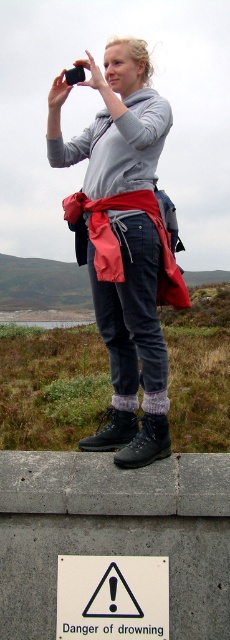
How far apart are gray concrete at upper center and white plastic sign at lower center?

gray concrete at upper center and white plastic sign at lower center are 21.43 centimeters apart from each other.

Where is `gray concrete at upper center`? This screenshot has height=640, width=230. gray concrete at upper center is located at coordinates (114, 532).

The image size is (230, 640). I want to click on gray concrete at upper center, so click(x=114, y=532).

In the scene shown: Which is more to the right, matte gray hoodie at center or white plastic sign at lower center?

Positioned to the right is white plastic sign at lower center.

Is matte gray hoodie at center above white plastic sign at lower center?

Correct, matte gray hoodie at center is located above white plastic sign at lower center.

Is point (135, 268) less distant than point (140, 595)?

That is False.

Locate an element on the screen. matte gray hoodie at center is located at coordinates 124,241.

Between gray concrete at upper center and matte gray hoodie at center, which one is positioned lower?

Positioned lower is gray concrete at upper center.

Which is in front, point (169, 636) or point (140, 444)?

Positioned in front is point (169, 636).

Which is behind, point (158, 529) or point (132, 36)?

The point (132, 36) is more distant.

Where is `gray concrete at upper center`? This screenshot has width=230, height=640. gray concrete at upper center is located at coordinates (114, 532).